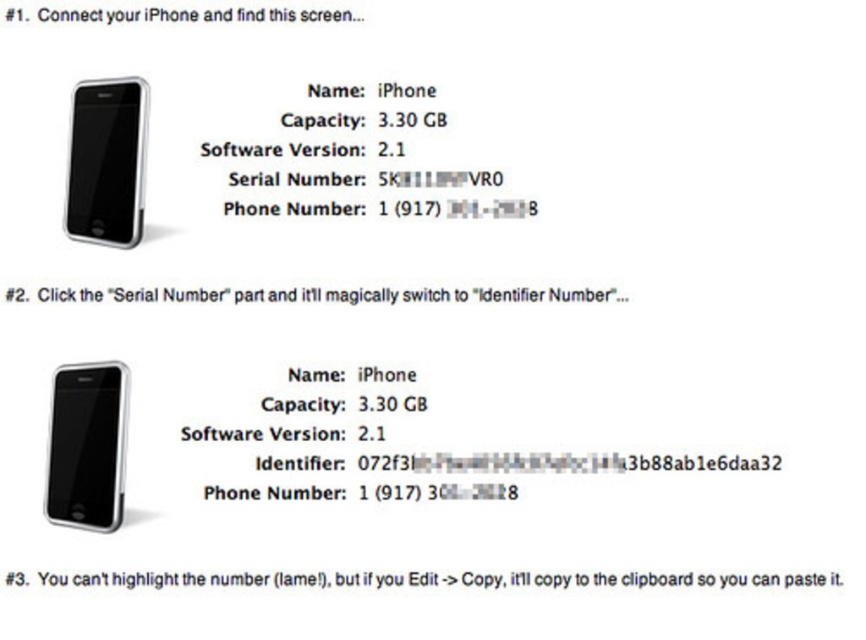
You are setting up a tech support guide and need to reference the exact position of the silver metallic smartphone at upper left in the image. According to the provided details, what are its coordinates?

The silver metallic smartphone at upper left is located at point (x=107, y=163).

You are looking at the first section of the image where the iPhone shows a screen with two points labeled. From your perspective, which point is closer to you? The options are point [91,88] and point [335,17].

Point [91,88] is in front of point [335,17], so it is closer to you.

You are trying to locate the matte black smartphone at center in the image. According to the coordinates provided, where exactly is it positioned?

The matte black smartphone at center is located at point coordinates of 0.698 along the x axis and 0.100 along the y axis.